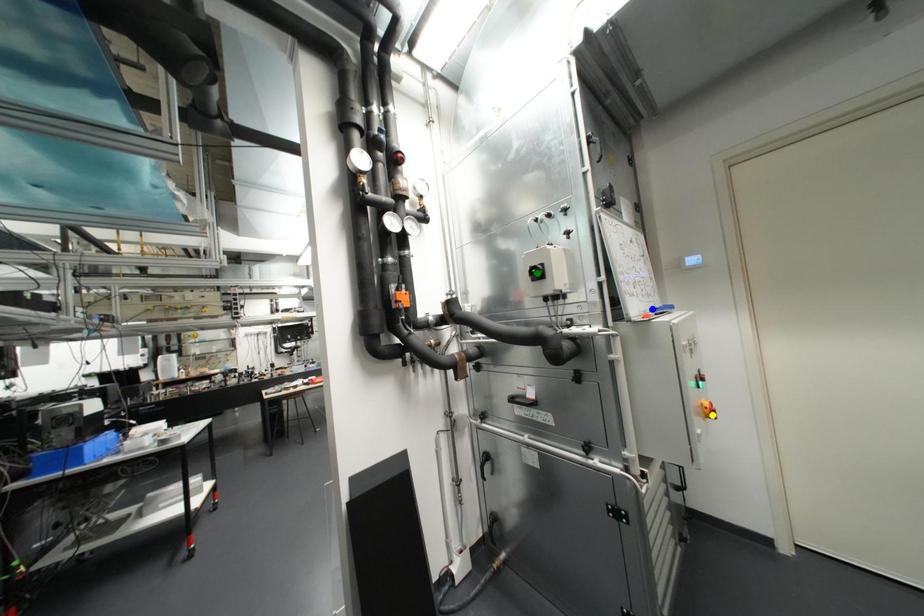
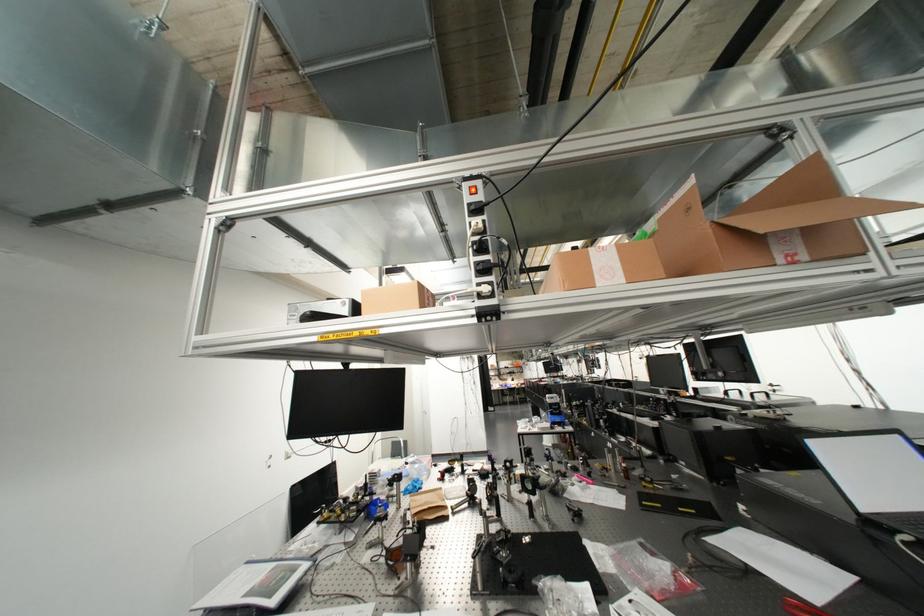
I am providing you with two images of the same scene from different viewpoints. Three points are marked in image1. Which point corresponds to a part or object that is occluded in image2?In image1, three points are marked. Which of them correspond to a part or object that is occluded in image2?Among the three points shown in image1, which one corresponds to a part or object that is no longer visible due to occlusion in image2?

blue point, green point, yellow point